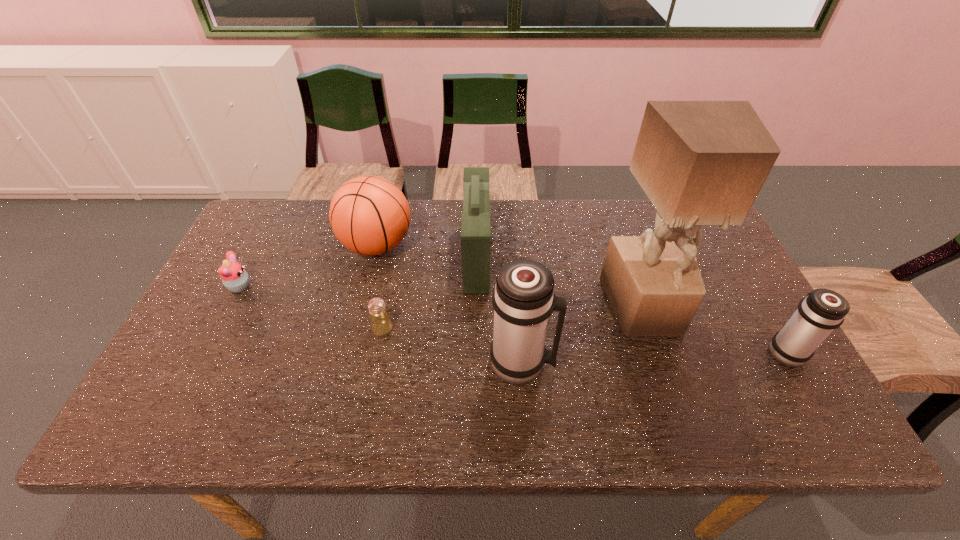
In order to click on free space for a new thermos bottle on the left in this screenshot , I will do `click(246, 375)`.